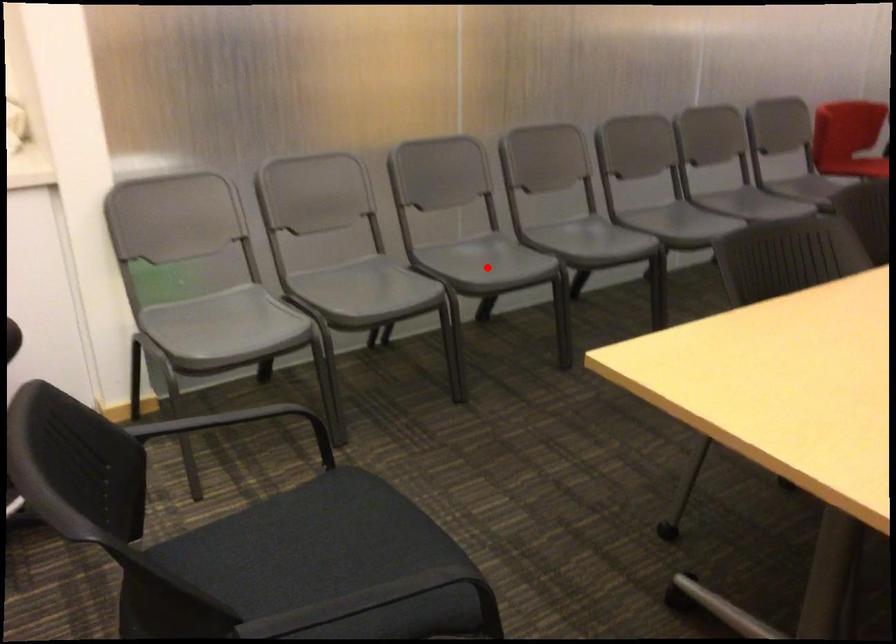
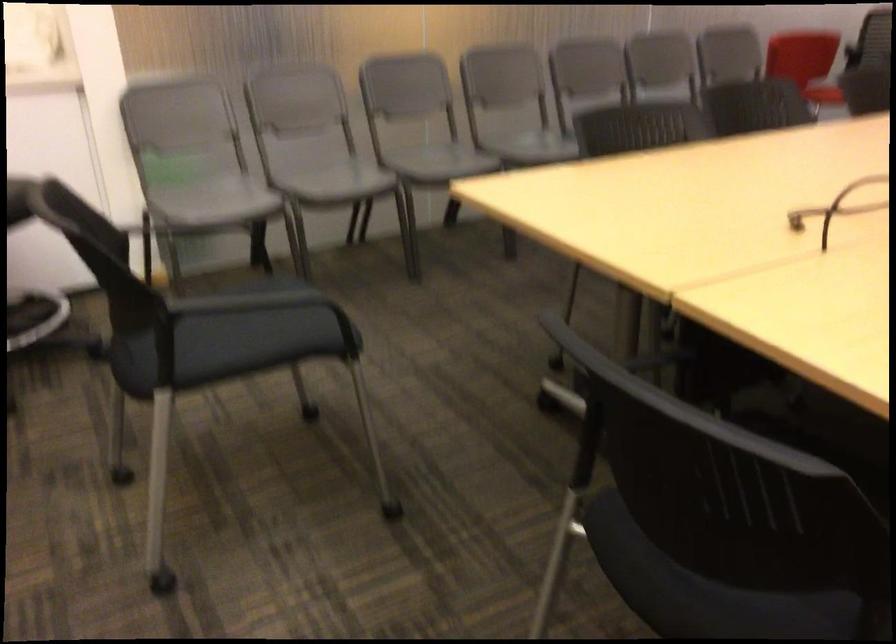
Question: I am providing you with two images of the same scene from different viewpoints. A red point is shown in image1. For the corresponding object point in image2, is it positioned nearer or farther from the camera?

Choices:
 (A) Nearer
 (B) Farther

Answer: (B)